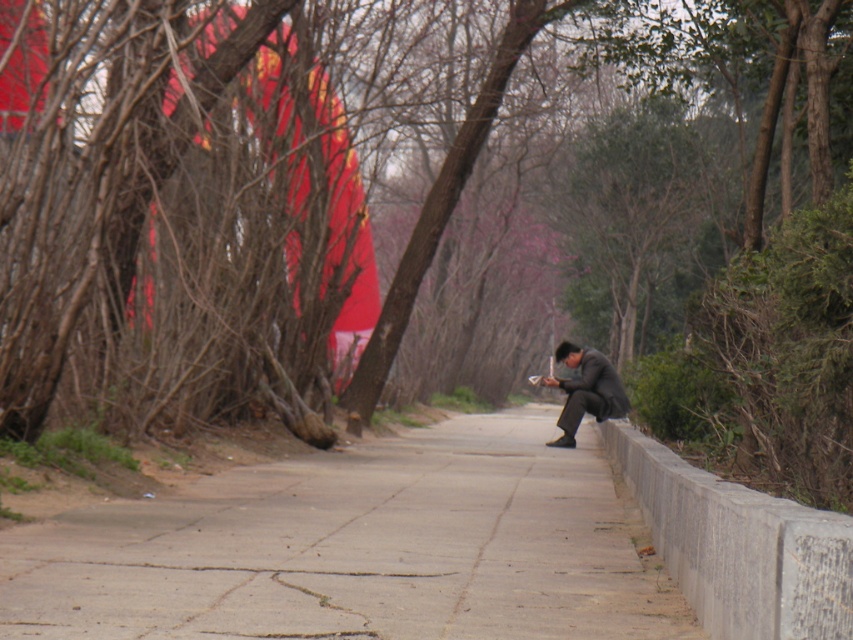
Question: Is the position of brown bark tree at center less distant than that of dark gray suit at center?

Choices:
 (A) no
 (B) yes

Answer: (B)

Question: Estimate the real-world distances between objects in this image. Which object is closer to the dark gray suit at center?

Choices:
 (A) brown bark tree at center
 (B) gray concrete ledge at lower right
 (C) concrete at right

Answer: (C)

Question: Which object is the farthest from the brown bark tree at center?

Choices:
 (A) concrete at right
 (B) dark gray suit at center

Answer: (B)

Question: Can you confirm if gray concrete ledge at lower right is positioned to the left of dark gray suit at center?

Choices:
 (A) yes
 (B) no

Answer: (A)

Question: Which is nearer to the dark gray suit at center?

Choices:
 (A) gray concrete ledge at lower right
 (B) brown bark tree at center
 (C) concrete at right

Answer: (C)

Question: Does gray concrete ledge at lower right appear over dark gray suit at center?

Choices:
 (A) no
 (B) yes

Answer: (A)